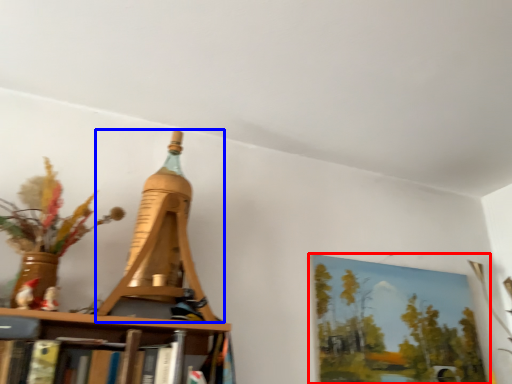
Question: Which of the following is the closest to the observer, picture frame (highlighted by a red box) or Eiffel tower (highlighted by a blue box)?

Choices:
 (A) picture frame
 (B) Eiffel tower

Answer: (B)